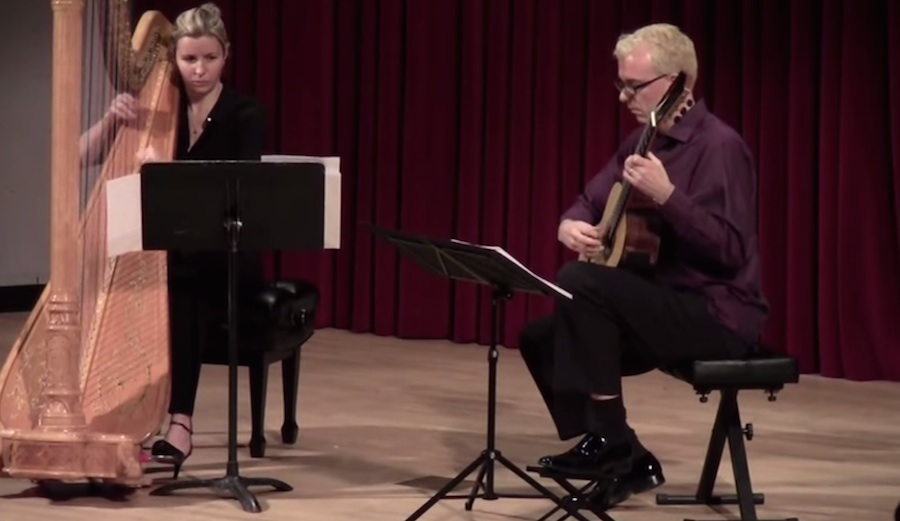
The image size is (900, 521). I want to click on black bench, so click(759, 372).